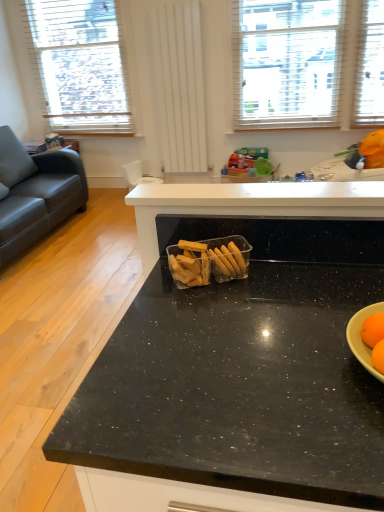
Question: Is white wooden blinds at upper left, which is the second window from right to left, taller than white textured window at upper center, which is the 2th window in left-to-right order?

Choices:
 (A) yes
 (B) no

Answer: (A)

Question: Is white wooden blinds at upper left, which is the second window from right to left, at the left side of white textured window at upper center, the first window when ordered from right to left?

Choices:
 (A) yes
 (B) no

Answer: (A)

Question: Is white wooden blinds at upper left, acting as the first window starting from the left, turned away from white textured window at upper center, the first window when ordered from right to left?

Choices:
 (A) no
 (B) yes

Answer: (A)

Question: Is white wooden blinds at upper left, which is the second window from right to left, bigger than white textured window at upper center, the first window when ordered from right to left?

Choices:
 (A) no
 (B) yes

Answer: (A)

Question: From a real-world perspective, is white wooden blinds at upper left, acting as the first window starting from the left, physically below white textured window at upper center, which is the 2th window in left-to-right order?

Choices:
 (A) yes
 (B) no

Answer: (B)

Question: Is white textured window at upper center, the first window when ordered from right to left, situated inside translucent plastic container of crackers at center or outside?

Choices:
 (A) outside
 (B) inside

Answer: (A)

Question: From the image's perspective, relative to translucent plastic container of crackers at center, is white textured window at upper center, the first window when ordered from right to left, above or below?

Choices:
 (A) below
 (B) above

Answer: (B)

Question: Considering the positions of white textured window at upper center, the first window when ordered from right to left, and translucent plastic container of crackers at center in the image, is white textured window at upper center, the first window when ordered from right to left, taller or shorter than translucent plastic container of crackers at center?

Choices:
 (A) short
 (B) tall

Answer: (B)

Question: Considering the relative positions of white textured window at upper center, the first window when ordered from right to left, and translucent plastic container of crackers at center in the image provided, is white textured window at upper center, the first window when ordered from right to left, to the left or to the right of translucent plastic container of crackers at center?

Choices:
 (A) right
 (B) left

Answer: (A)

Question: From the image's perspective, relative to white wooden blinds at upper left, acting as the first window starting from the left, is translucent plastic container of crackers at center above or below?

Choices:
 (A) below
 (B) above

Answer: (A)

Question: Based on their sizes in the image, would you say translucent plastic container of crackers at center is bigger or smaller than white wooden blinds at upper left, acting as the first window starting from the left?

Choices:
 (A) small
 (B) big

Answer: (A)

Question: Looking at their shapes, would you say translucent plastic container of crackers at center is wider or thinner than white wooden blinds at upper left, acting as the first window starting from the left?

Choices:
 (A) wide
 (B) thin

Answer: (B)

Question: Choose the correct answer: Is translucent plastic container of crackers at center inside white wooden blinds at upper left, acting as the first window starting from the left, or outside it?

Choices:
 (A) outside
 (B) inside

Answer: (A)

Question: In terms of size, does white wooden blinds at upper left, acting as the first window starting from the left, appear bigger or smaller than translucent plastic container of crackers at center?

Choices:
 (A) big
 (B) small

Answer: (A)

Question: Considering the positions of point (86, 90) and point (231, 238), is point (86, 90) closer or farther from the camera than point (231, 238)?

Choices:
 (A) closer
 (B) farther

Answer: (B)